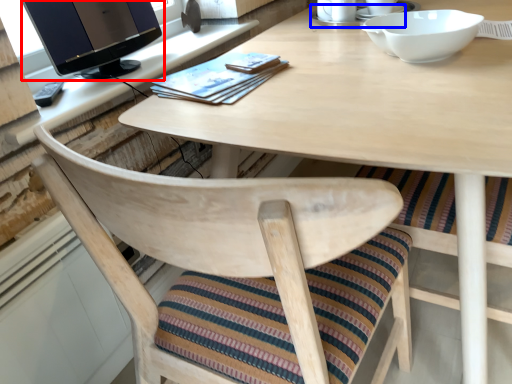
Question: Which object appears closest to the camera in this image, computer monitor (highlighted by a red box) or saucer (highlighted by a blue box)?

Choices:
 (A) computer monitor
 (B) saucer

Answer: (A)